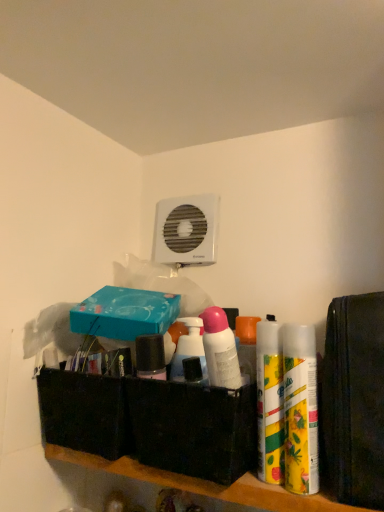
Question: Considering the relative sizes of yellow matte spray can at right, which ranks as the first cleaning product in right-to-left order, and yellow matte can at right, acting as the 2th cleaning product starting from the right, in the image provided, is yellow matte spray can at right, which ranks as the first cleaning product in right-to-left order, thinner than yellow matte can at right, acting as the 2th cleaning product starting from the right,?

Choices:
 (A) yes
 (B) no

Answer: (B)

Question: Is yellow matte spray can at right, which ranks as the 3th cleaning product in left-to-right order, at the right side of yellow matte can at right, acting as the 2th cleaning product starting from the right?

Choices:
 (A) yes
 (B) no

Answer: (A)

Question: Is yellow matte spray can at right, which ranks as the first cleaning product in right-to-left order, oriented away from yellow matte can at right, which is the 2th cleaning product in left-to-right order?

Choices:
 (A) no
 (B) yes

Answer: (A)

Question: From the image's perspective, is yellow matte spray can at right, which ranks as the 3th cleaning product in left-to-right order, under yellow matte can at right, which is the 2th cleaning product in left-to-right order?

Choices:
 (A) yes
 (B) no

Answer: (B)

Question: From the image's perspective, would you say yellow matte spray can at right, which ranks as the first cleaning product in right-to-left order, is positioned over yellow matte can at right, which is the 2th cleaning product in left-to-right order?

Choices:
 (A) no
 (B) yes

Answer: (B)

Question: Is yellow matte spray can at right, which ranks as the first cleaning product in right-to-left order, smaller than yellow matte can at right, acting as the 2th cleaning product starting from the right?

Choices:
 (A) no
 (B) yes

Answer: (A)

Question: From a real-world perspective, is teal matte box at upper center, the 1th box when ordered from top to bottom, under yellow matte spray can at right, which ranks as the first cleaning product in right-to-left order?

Choices:
 (A) no
 (B) yes

Answer: (A)

Question: From the image's perspective, is teal matte box at upper center, arranged as the second box when ordered from the bottom, beneath yellow matte spray can at right, which ranks as the 3th cleaning product in left-to-right order?

Choices:
 (A) no
 (B) yes

Answer: (A)

Question: Is teal matte box at upper center, the 1th box when ordered from top to bottom, touching yellow matte spray can at right, which ranks as the first cleaning product in right-to-left order?

Choices:
 (A) yes
 (B) no

Answer: (B)

Question: Is teal matte box at upper center, the 1th box when ordered from top to bottom, turned away from yellow matte spray can at right, which ranks as the 3th cleaning product in left-to-right order?

Choices:
 (A) no
 (B) yes

Answer: (A)

Question: Can you confirm if teal matte box at upper center, arranged as the second box when ordered from the bottom, is thinner than yellow matte spray can at right, which ranks as the 3th cleaning product in left-to-right order?

Choices:
 (A) yes
 (B) no

Answer: (B)

Question: Is teal matte box at upper center, arranged as the second box when ordered from the bottom, bigger than yellow matte spray can at right, which ranks as the first cleaning product in right-to-left order?

Choices:
 (A) yes
 (B) no

Answer: (A)

Question: Is yellow matte can at right, which is the 2th cleaning product in left-to-right order, beside teal matte box at upper center, arranged as the second box when ordered from the bottom?

Choices:
 (A) no
 (B) yes

Answer: (A)